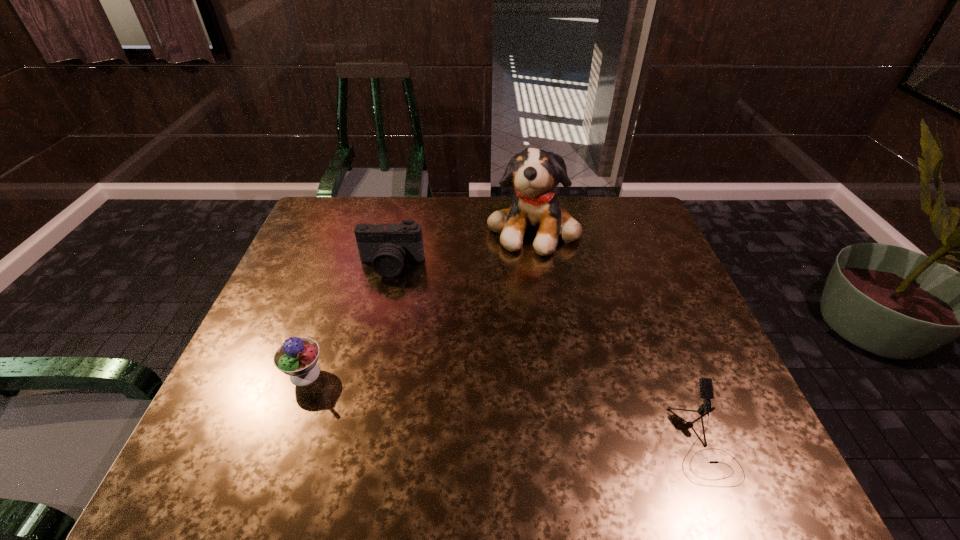
Locate which object is the closest to the camera. Please provide its 2D coordinates. Your answer should be formatted as a tuple, i.e. [(x, y)], where the tuple contains the x and y coordinates of a point satisfying the conditions above.

[(534, 173)]

Locate which object ranks third in proximity to the second object from right to left. Please provide its 2D coordinates. Your answer should be formatted as a tuple, i.e. [(x, y)], where the tuple contains the x and y coordinates of a point satisfying the conditions above.

[(297, 357)]